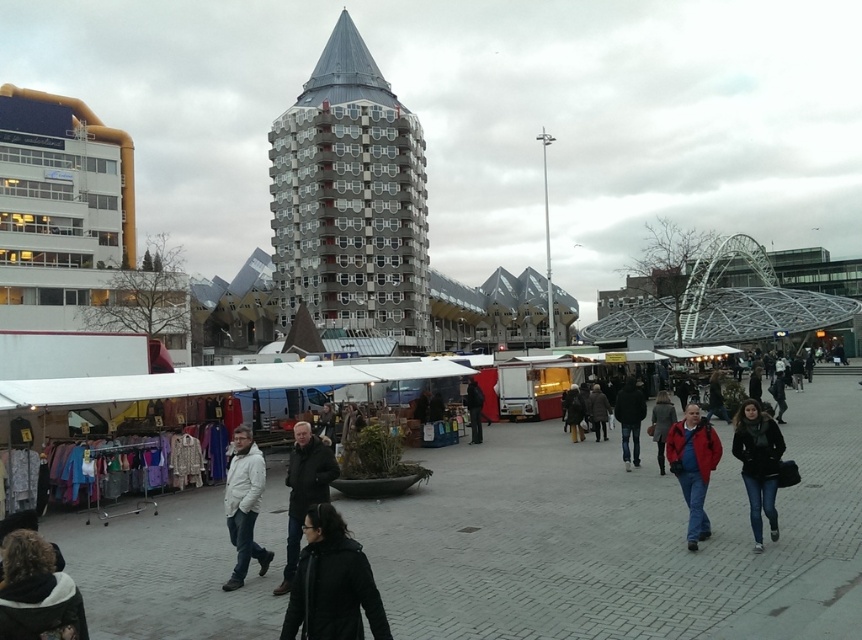
You are a delivery person carrying a package that requires you to navigate through the market. You need to move from the dark brown leather jacket at center to the dark brown leather jacket at lower left. Given that your delivery cart is 2 meters wide, will you be able to pass through the space between them?

The distance between the dark brown leather jacket at center and the dark brown leather jacket at lower left is 4.50 meters. Since the cart is 2 meters wide, it can easily pass through the space between them as the distance is more than sufficient.

You are a customer at the market and want to buy both the jeans at center and the black matte jacket at center. If you first pick up the item on your left, which item will you have in your hand?

The jeans at center is positioned on the left side of black matte jacket at center, so if you first pick up the item on your left, you will have the jeans at center in your hand.

You are a shopper in the market and want to pick up the dark brown leather jacket at center first before reaching the dark brown leather jacket at lower left. Which jacket should you approach first and why?

You should approach the dark brown leather jacket at center first because it is closer to you than the dark brown leather jacket at lower left, which is further away.